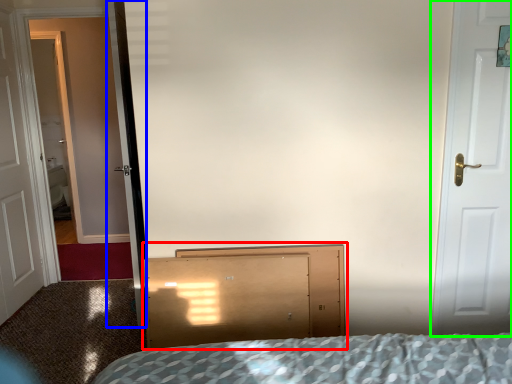
Question: Estimate the real-world distances between objects in this image. Which object is closer to dresser (highlighted by a red box), screen door (highlighted by a blue box) or door (highlighted by a green box)?

Choices:
 (A) screen door
 (B) door

Answer: (A)